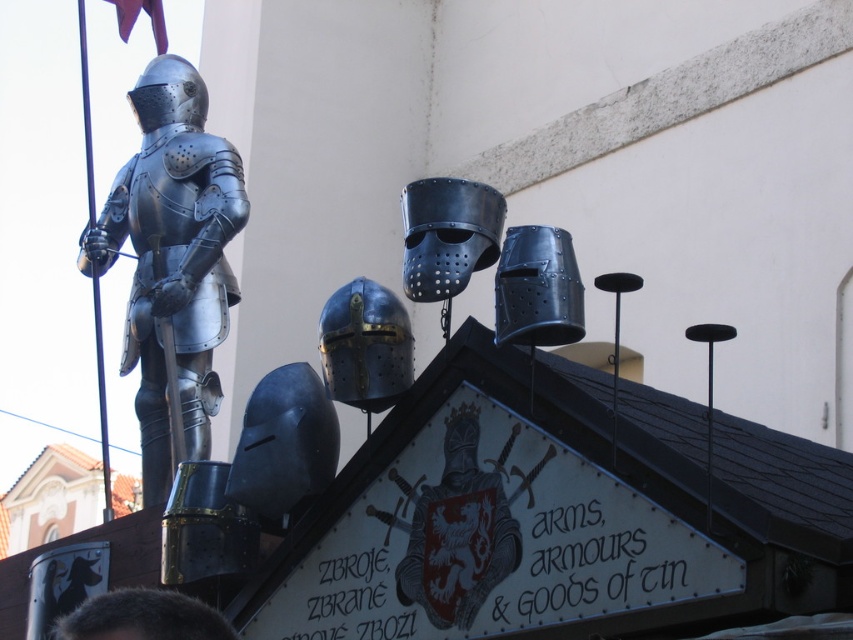
You are a visitor at the medieval display and want to touch the black leather helmet at center and the shiny silver helmet at upper left. Which one can you reach without moving your position?

The black leather helmet at center is closer to the viewer than the shiny silver helmet at upper left, so you can reach it without moving.

Based on the coordinates provided, where is the shiny silver armor at left located in the image?

The shiny silver armor at left is located at the coordinates point (172, 257).